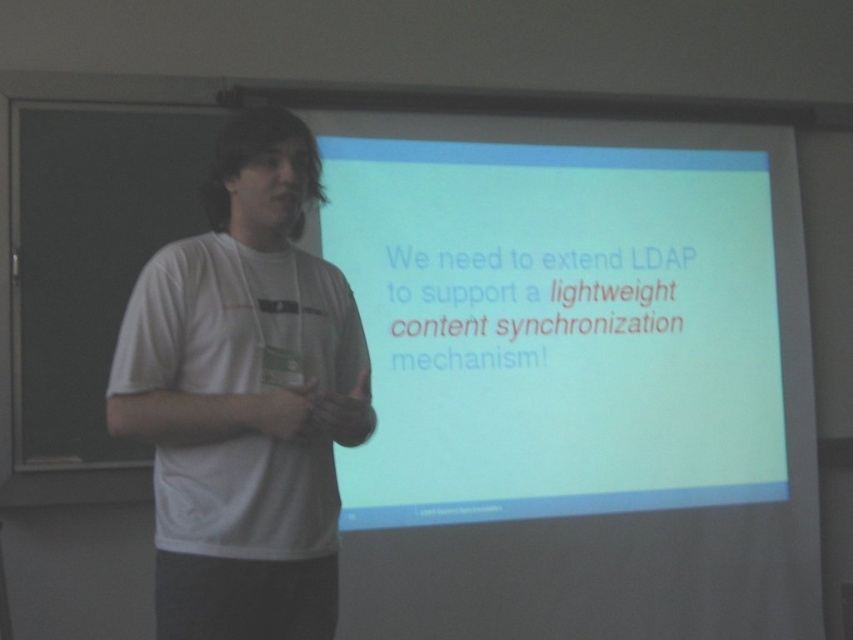
Question: Is white matte projection screen at center to the right of white cotton shirt at center from the viewer's perspective?

Choices:
 (A) no
 (B) yes

Answer: (B)

Question: Which of the following is the farthest from the observer?

Choices:
 (A) white cotton shirt at center
 (B) white matte projection screen at center

Answer: (B)

Question: Does white matte projection screen at center have a greater width compared to white cotton shirt at center?

Choices:
 (A) no
 (B) yes

Answer: (B)

Question: Considering the relative positions of white matte projection screen at center and white cotton shirt at center in the image provided, where is white matte projection screen at center located with respect to white cotton shirt at center?

Choices:
 (A) left
 (B) right

Answer: (B)